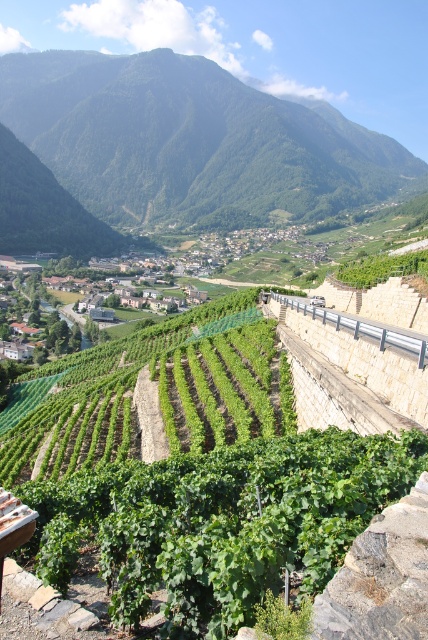
Question: Which of the following is the farthest from the observer?

Choices:
 (A) green leafy vineyard at center
 (B) green leafy hillside at upper center

Answer: (B)

Question: Does green leafy hillside at upper center have a smaller size compared to green leafy vineyard at center?

Choices:
 (A) no
 (B) yes

Answer: (A)

Question: Is green leafy hillside at upper center smaller than green leafy vineyard at center?

Choices:
 (A) yes
 (B) no

Answer: (B)

Question: Is green leafy hillside at upper center smaller than green leafy vineyard at center?

Choices:
 (A) yes
 (B) no

Answer: (B)

Question: Among these objects, which one is nearest to the camera?

Choices:
 (A) green leafy vineyard at center
 (B) green leafy hillside at upper center

Answer: (A)

Question: Which point is farther to the camera?

Choices:
 (A) green leafy hillside at upper center
 (B) green leafy vineyard at center

Answer: (A)